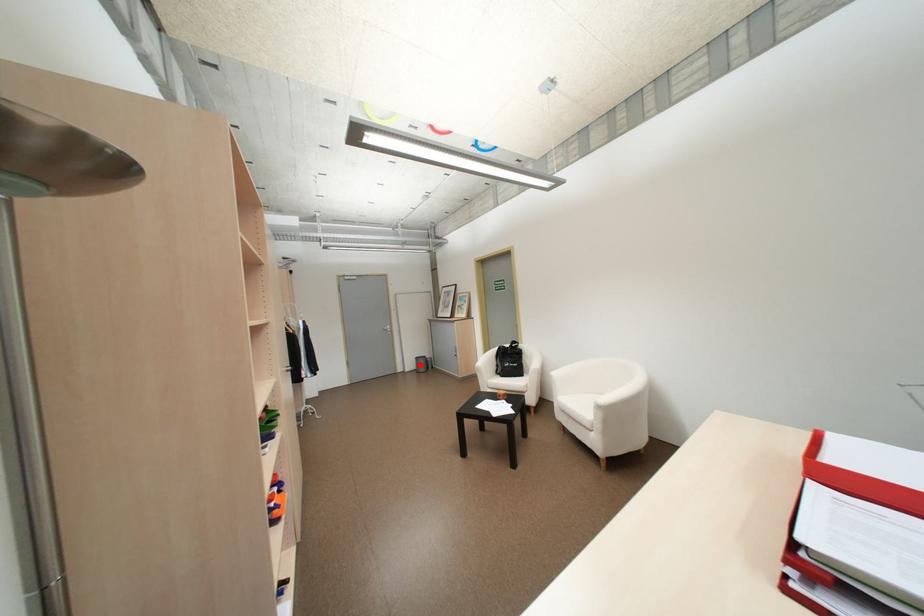
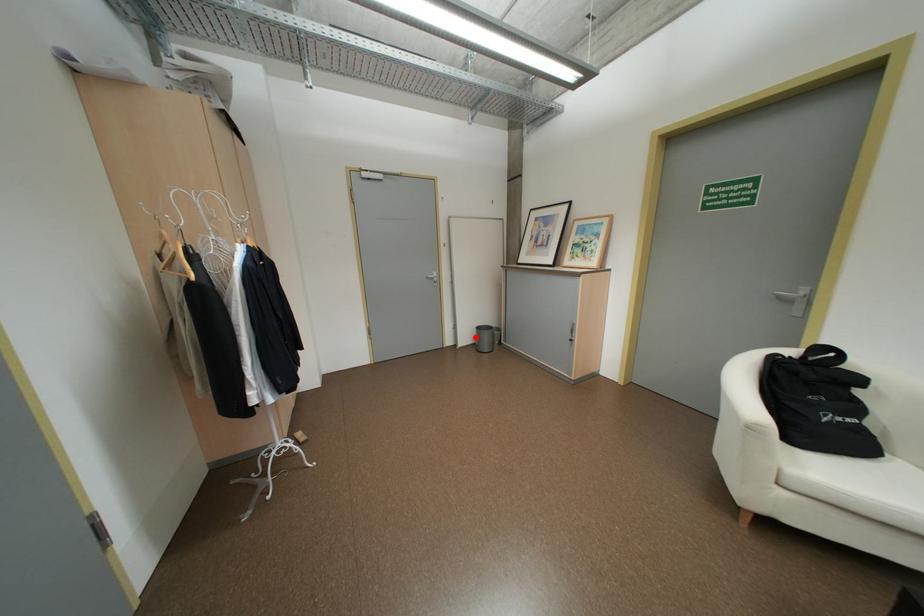
I am providing you with two images of the same scene from different viewpoints. A red point is marked on the first image and another point is marked on the second image. Does the point marked in image1 correspond to the same location as the one in image2?

Yes